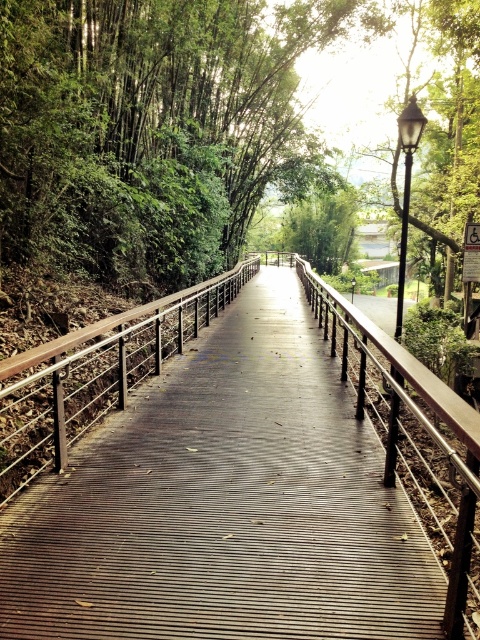
You are standing on the wooden walkway at center and want to place a large potted plant on the brown wooden balustrade at center. Based on their sizes, will the potted plant fit on the balustrade?

The wooden walkway at center is bigger than the brown wooden balustrade at center. Since the balustrade is smaller, the large potted plant may not fit on it.

Consider the image. You are standing on the wooden walkway at center and want to place a potted plant on the brown wooden balustrade at center. Is the balustrade above or below the walkway?

The wooden walkway at center is positioned under the brown wooden balustrade at center, so the balustrade is above the walkway.